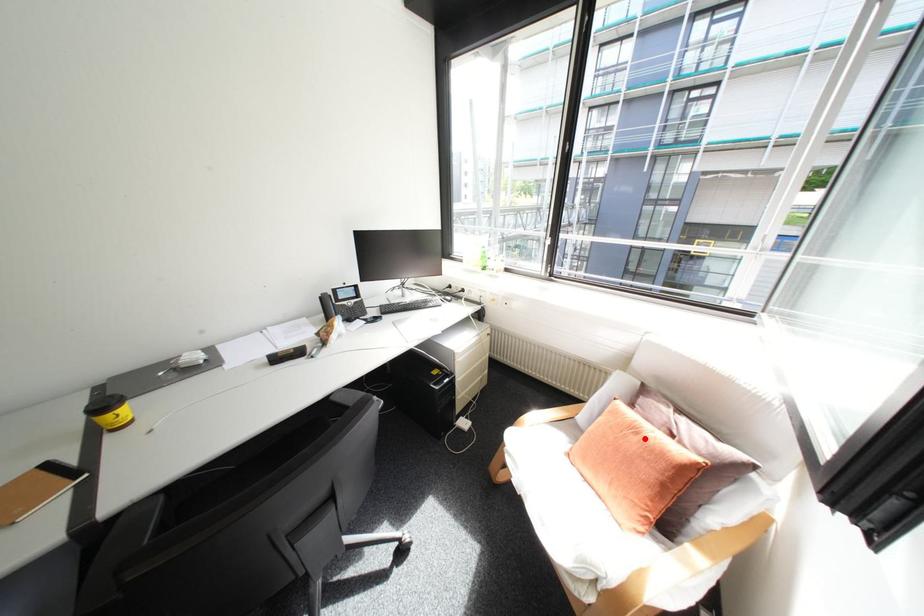
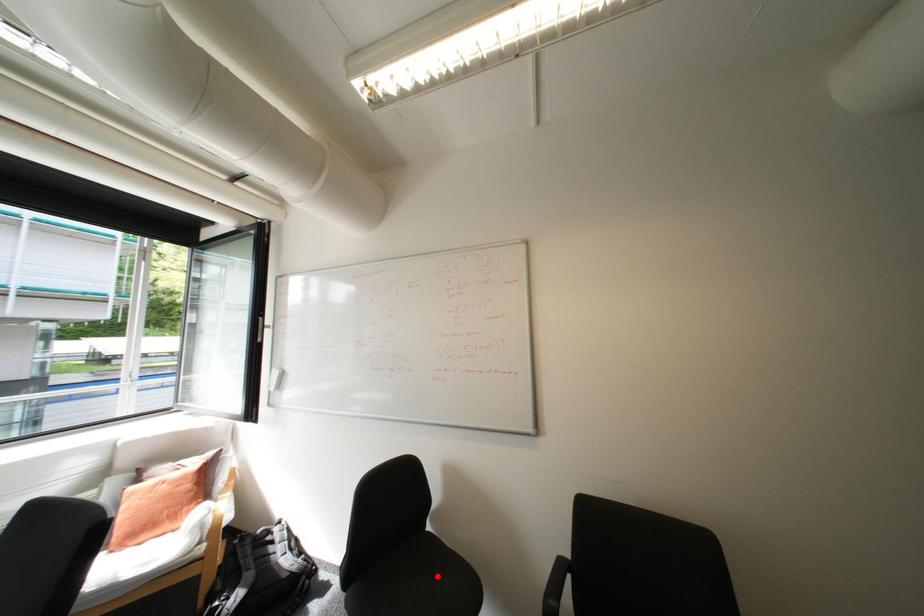
I am providing you with two images of the same scene from different viewpoints. A red point is marked on the first image and another point is marked on the second image. Is the red point in image1 aligned with the point shown in image2?

No